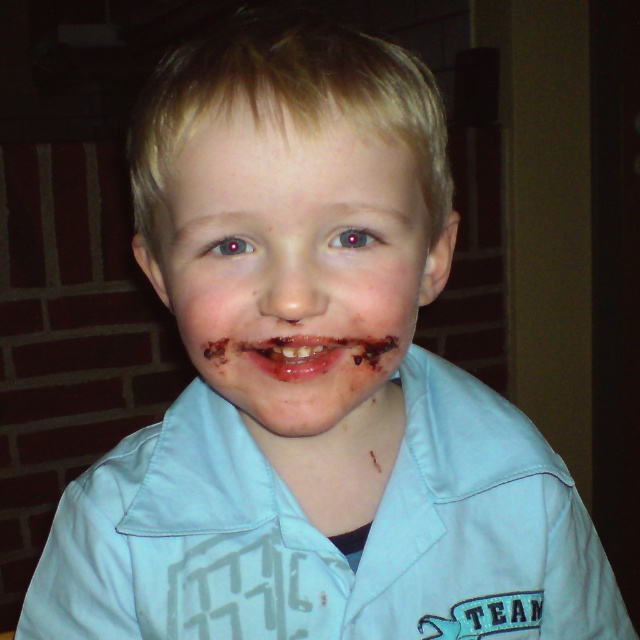
You are a photographer adjusting your camera settings. The subject is the chocolate matte face at center. To ensure the subject is in focus, what is the minimum distance you should set the camera focus to?

The minimum focus distance should be set to at least 12.89 inches to ensure the chocolate matte face at center is in focus.